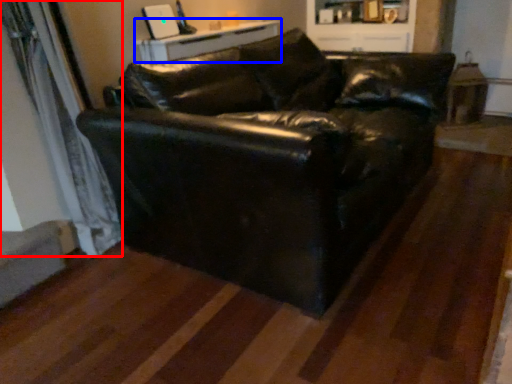
Question: Among these objects, which one is nearest to the camera, curtain (highlighted by a red box) or table (highlighted by a blue box)?

Choices:
 (A) curtain
 (B) table

Answer: (A)